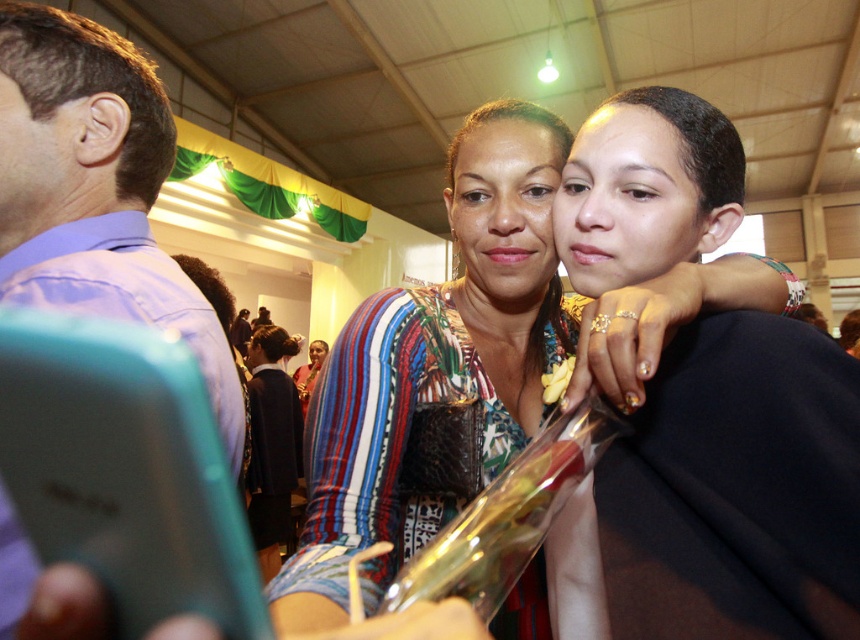
Who is higher up, multicolored fabric scarf at upper right or purple cotton shirt at left?

purple cotton shirt at left

Is multicolored fabric scarf at upper right further to camera compared to purple cotton shirt at left?

Yes, multicolored fabric scarf at upper right is further from the viewer.

Locate an element on the screen. The width and height of the screenshot is (860, 640). multicolored fabric scarf at upper right is located at coordinates (736, 488).